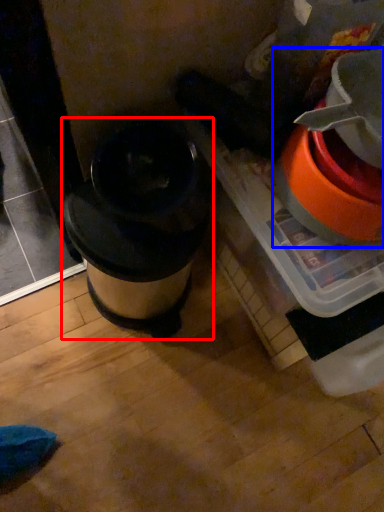
Question: Which object appears closest to the camera in this image, waste container (highlighted by a red box) or appliance (highlighted by a blue box)?

Choices:
 (A) waste container
 (B) appliance

Answer: (B)